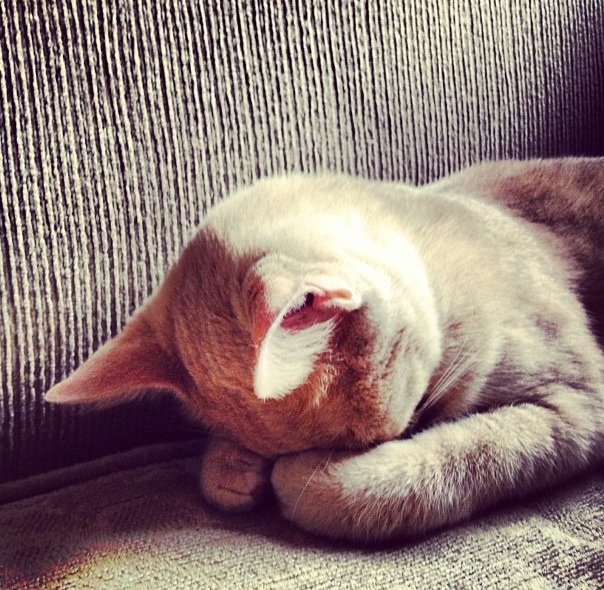
Locate an element on the screen. This screenshot has height=590, width=604. couch cushion is located at coordinates (255, 557).